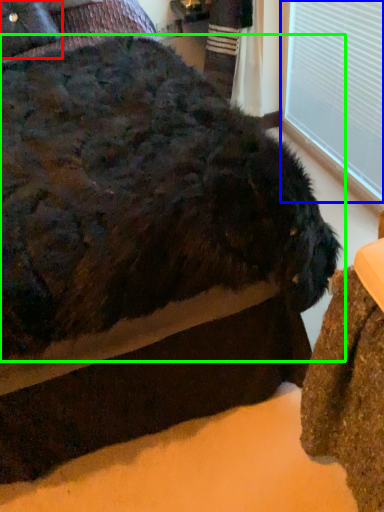
Question: Based on their relative distances, which object is farther from pillow (highlighted by a red box)? Choose from window frame (highlighted by a blue box) and dog (highlighted by a green box).

Choices:
 (A) window frame
 (B) dog

Answer: (A)